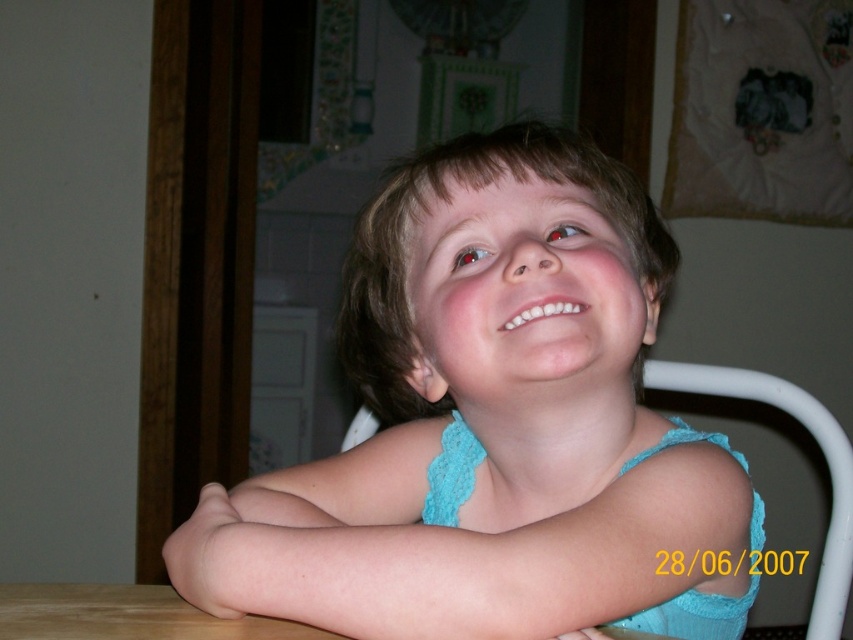
You are a tailor measuring fabrics for a new project. You see the light blue fabric at center and the white plastic chair at center in the room. Which object is wider?

The light blue fabric at center is wider than the white plastic chair at center according to the description.

You are a photographer setting up for a portrait. The child is sitting with their smooth skin at lower center and there is a white plastic chair at center in the background. To ensure the chair is not distracting, should you adjust the camera focus to highlight the child instead?

Yes, since the smooth skin at lower center is in front of the white plastic chair at center, adjusting focus to highlight the child will naturally blur the background chair, making it less distracting.